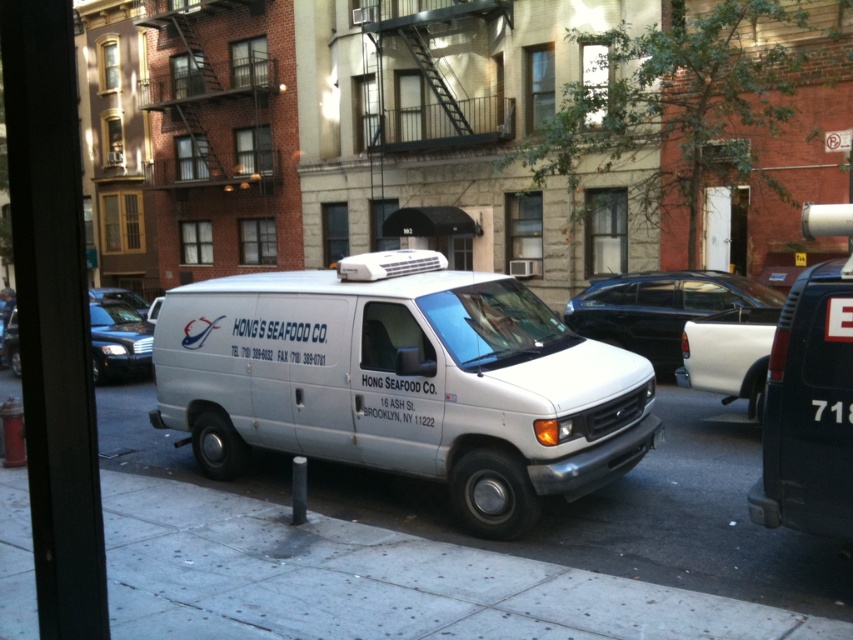
Question: Estimate the real-world distances between objects in this image. Which object is closer to the matte white van at left?

Choices:
 (A) white matte van at center
 (B) shiny black sedan at left

Answer: (B)

Question: Can you confirm if black glossy sedan at center is positioned above shiny black sedan at left?

Choices:
 (A) no
 (B) yes

Answer: (A)

Question: Which of these objects is positioned farthest from the white matte van at center?

Choices:
 (A) matte white van at left
 (B) gray concrete pavement at center
 (C) black glossy sedan at center
 (D) shiny black sedan at left

Answer: (D)

Question: Can you confirm if white matte van at center is positioned below gray concrete pavement at center?

Choices:
 (A) yes
 (B) no

Answer: (B)

Question: Is the position of white matte van at center more distant than that of matte white van at left?

Choices:
 (A) no
 (B) yes

Answer: (A)

Question: Which of the following is the farthest from the observer?

Choices:
 (A) matte white van at left
 (B) black glossy sedan at center
 (C) gray concrete pavement at center
 (D) white matte van at center

Answer: (A)